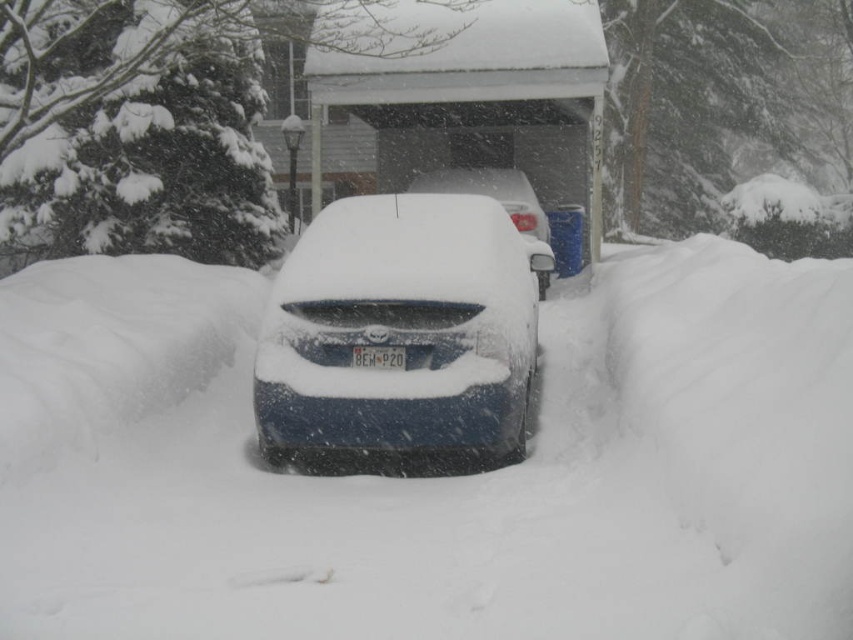
Question: Is white fluffy snow at center positioned in front of sleek blue car at center?

Choices:
 (A) yes
 (B) no

Answer: (A)

Question: Observing the image, what is the correct spatial positioning of white fluffy snow at center in reference to sleek blue car at center?

Choices:
 (A) above
 (B) below

Answer: (B)

Question: Which of the following is the farthest from the observer?

Choices:
 (A) (424, 179)
 (B) (355, 364)
 (C) (190, 483)

Answer: (A)

Question: Based on their relative distances, which object is nearer to the sleek blue car at center?

Choices:
 (A) white fluffy snow at center
 (B) sleek blue sedan at center

Answer: (B)

Question: Does white fluffy snow at center appear on the right side of sleek blue sedan at center?

Choices:
 (A) yes
 (B) no

Answer: (B)

Question: Which of the following is the closest to the observer?

Choices:
 (A) sleek blue sedan at center
 (B) white plastic license plate at center
 (C) sleek blue car at center

Answer: (A)